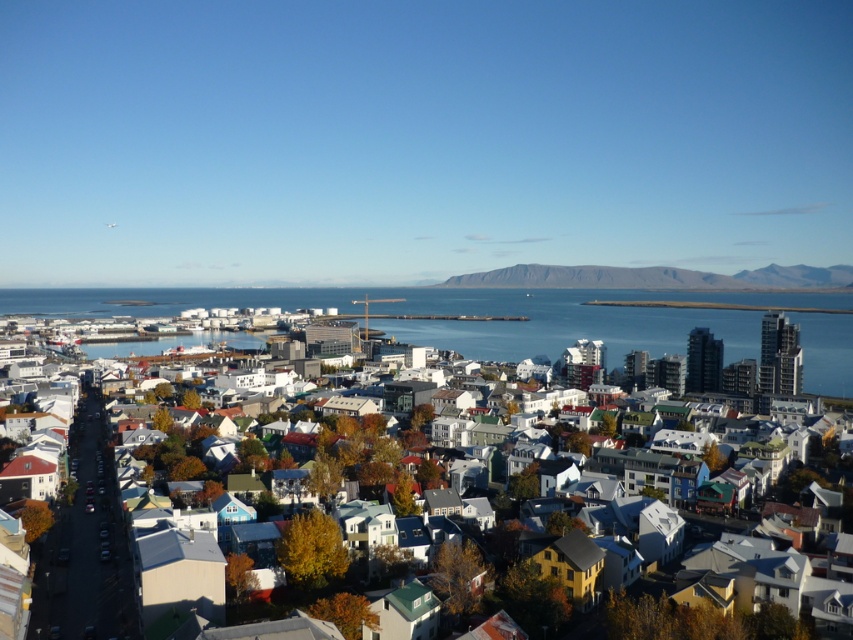
Question: Which of the following is the closest to the observer?

Choices:
 (A) (747, 352)
 (B) (839, 394)

Answer: (B)

Question: Among these objects, which one is nearest to the camera?

Choices:
 (A) rocky gray cliff at center
 (B) white matte buildings at center
 (C) blue water at center

Answer: (B)

Question: Does blue water at center come in front of white matte buildings at center?

Choices:
 (A) yes
 (B) no

Answer: (B)

Question: Which of the following is the farthest from the observer?

Choices:
 (A) (497, 353)
 (B) (540, 273)

Answer: (B)

Question: Considering the relative positions of blue water at center and rocky gray cliff at center in the image provided, where is blue water at center located with respect to rocky gray cliff at center?

Choices:
 (A) above
 (B) below

Answer: (B)

Question: Does white matte buildings at center have a lesser width compared to rocky gray cliff at center?

Choices:
 (A) yes
 (B) no

Answer: (B)